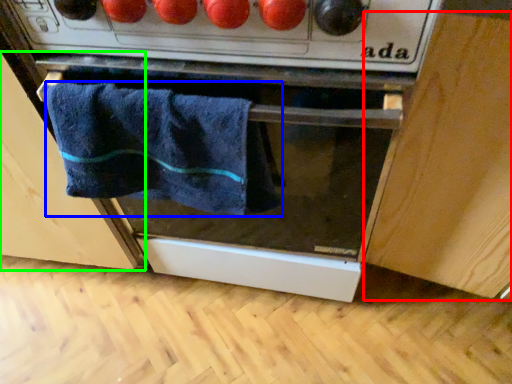
Question: Which object is positioned closest to cabinetry (highlighted by a red box)? Select from towel (highlighted by a blue box) and cabinetry (highlighted by a green box).

Choices:
 (A) towel
 (B) cabinetry

Answer: (A)